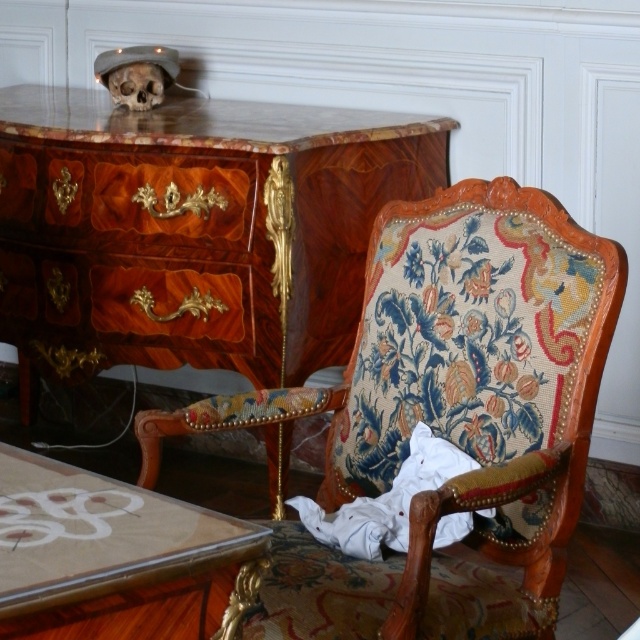
You are a furniture designer who needs to ensure that all items in the room are at least 1.2 meters tall. Based on the scene, can the wooden armchair with floral upholstery at center and the translucent glass table at lower left meet this requirement?

The wooden armchair with floral upholstery at center is taller than the translucent glass table at lower left. However, without knowing the exact height of the armchair, we cannot confirm if both meet the 1.2 meter requirement. Further measurements are needed.

Please provide the coordinates of the wooden armchair with floral upholstery at center in the image.

The wooden armchair with floral upholstery at center is located at coordinates point (460, 380).

You are a painter who needs to place a 2.5 feet tall sculpture on either the wooden armchair with floral upholstery at center or the mahogany wood drawer at center. Based on their heights, which object would be a more stable base for the sculpture?

The wooden armchair with floral upholstery at center is much taller than the mahogany wood drawer at center, so the sculpture would be more stable on the mahogany wood drawer at center since it provides a lower, more secure base.